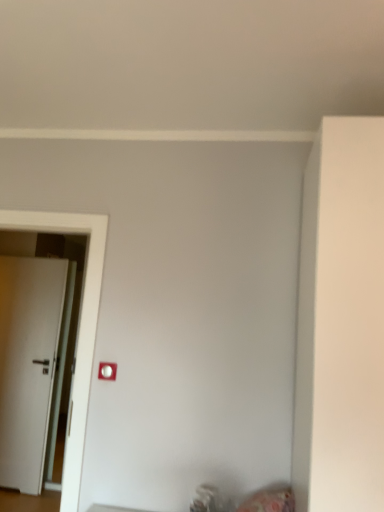
Question: Does white plastic light switch at center have a greater width compared to white matte door at left?

Choices:
 (A) no
 (B) yes

Answer: (A)

Question: Can you confirm if white plastic light switch at center is thinner than white matte door at left?

Choices:
 (A) yes
 (B) no

Answer: (A)

Question: Is white plastic light switch at center closer to camera compared to white matte door at left?

Choices:
 (A) no
 (B) yes

Answer: (B)

Question: Is white plastic light switch at center in contact with white matte door at left?

Choices:
 (A) yes
 (B) no

Answer: (B)

Question: Does white plastic light switch at center appear on the left side of white matte door at left?

Choices:
 (A) no
 (B) yes

Answer: (A)

Question: Is white matte door at left completely or partially inside white plastic light switch at center?

Choices:
 (A) yes
 (B) no

Answer: (B)

Question: Is white matte door at left completely or partially outside of white plastic light switch at center?

Choices:
 (A) yes
 (B) no

Answer: (A)

Question: Is white matte door at left bigger than white plastic light switch at center?

Choices:
 (A) no
 (B) yes

Answer: (B)

Question: Can you confirm if white matte door at left is wider than white plastic light switch at center?

Choices:
 (A) no
 (B) yes

Answer: (B)

Question: From a real-world perspective, is white matte door at left positioned under white plastic light switch at center based on gravity?

Choices:
 (A) yes
 (B) no

Answer: (A)

Question: From a real-world perspective, is white matte door at left physically above white plastic light switch at center?

Choices:
 (A) no
 (B) yes

Answer: (A)

Question: Is white matte door at left smaller than white plastic light switch at center?

Choices:
 (A) yes
 (B) no

Answer: (B)

Question: Considering the positions of point (9, 446) and point (107, 368), is point (9, 446) closer or farther from the camera than point (107, 368)?

Choices:
 (A) closer
 (B) farther

Answer: (B)